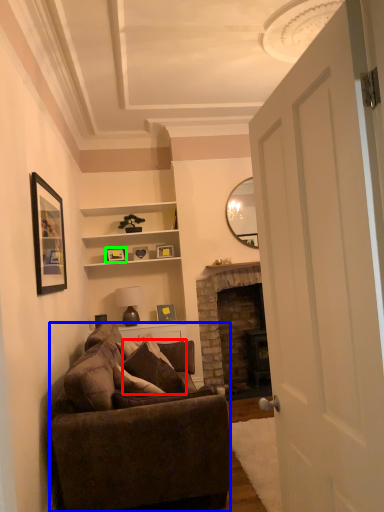
Question: Based on their relative distances, which object is nearer to pillow (highlighted by a red box)? Choose from studio couch (highlighted by a blue box) and picture frame (highlighted by a green box).

Choices:
 (A) studio couch
 (B) picture frame

Answer: (A)